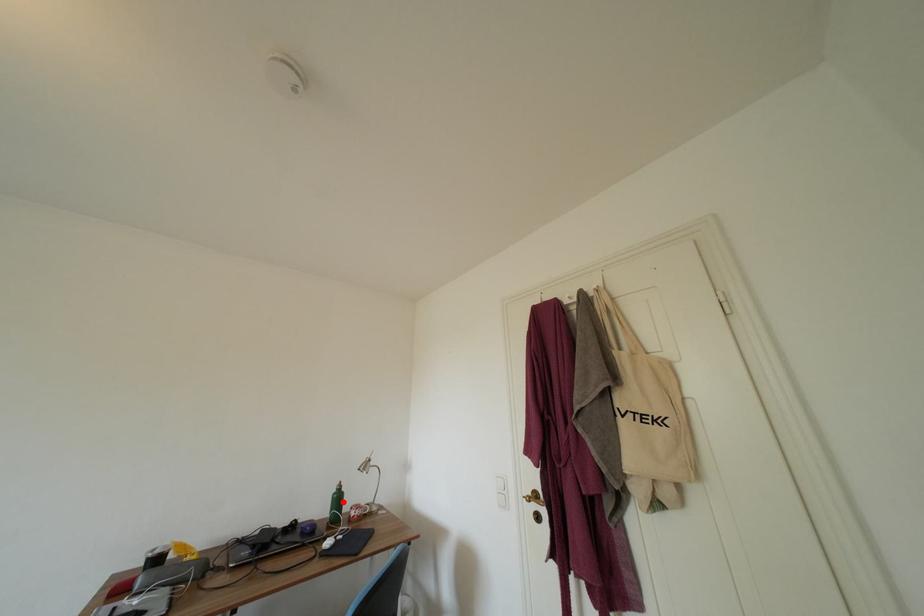
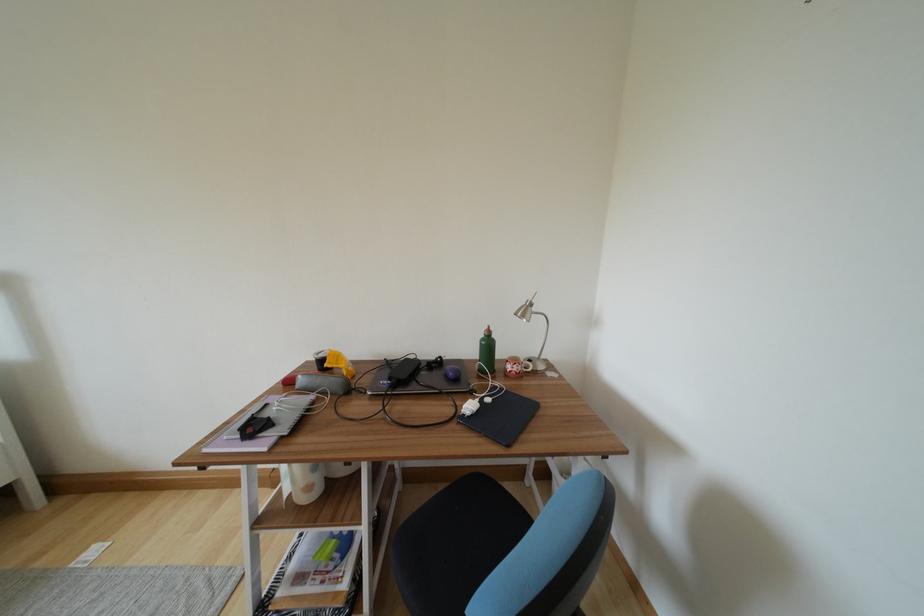
Find the pixel in the second image that matches the highlighted location in the first image.

(493, 349)